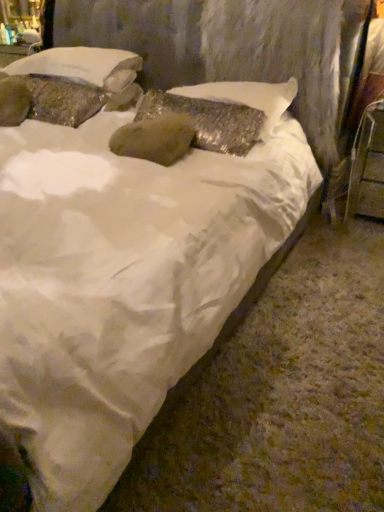
Question: Is shiny metallic pillow at center, placed as the 1th pillow when sorted from right to left, bigger or smaller than textured stone pillow at upper left, marked as the 1th pillow in a left-to-right arrangement?

Choices:
 (A) big
 (B) small

Answer: (A)

Question: From the image's perspective, is shiny metallic pillow at center, placed as the third pillow when sorted from left to right, positioned above or below textured stone pillow at upper left, marked as the 1th pillow in a left-to-right arrangement?

Choices:
 (A) above
 (B) below

Answer: (B)

Question: Which object is positioned farthest from the shiny metallic pillow at center, placed as the 1th pillow when sorted from right to left?

Choices:
 (A) textured stone pillow at upper left, placed as the 2th pillow when sorted from right to left
 (B) textured stone pillow at upper left, acting as the 3th pillow starting from the right
 (C) metallic silver chair at right

Answer: (B)

Question: Estimate the real-world distances between objects in this image. Which object is farther from the shiny metallic pillow at center, placed as the third pillow when sorted from left to right?

Choices:
 (A) textured stone pillow at upper left, placed as the 2th pillow when sorted from right to left
 (B) textured stone pillow at upper left, marked as the 1th pillow in a left-to-right arrangement
 (C) metallic silver chair at right

Answer: (B)